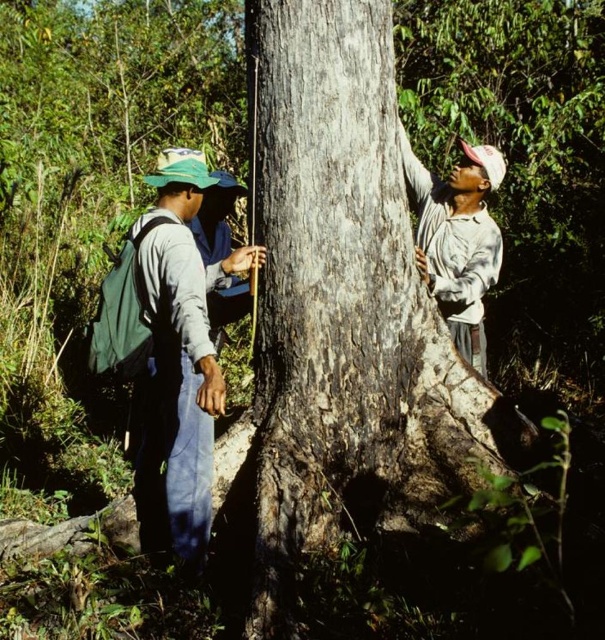
You are standing in a forest and see the dark brown rough bark at center and the green fabric shirt at center. Which object is positioned to the right?

The dark brown rough bark at center is to the right of the green fabric shirt at center.

You are standing at the center of the scene and want to hand a tool to both the green canvas backpack at left and the white matte shirt at upper right. Which one is closer to you?

The green canvas backpack at left is closer to you because it is in front of the white matte shirt at upper right.

You are a hiker who needs to pack your essentials. You have a green canvas backpack at left and a green fabric shirt at center. Which item can hold more items?

The green canvas backpack at left is larger in size than the green fabric shirt at center, so it can hold more items.